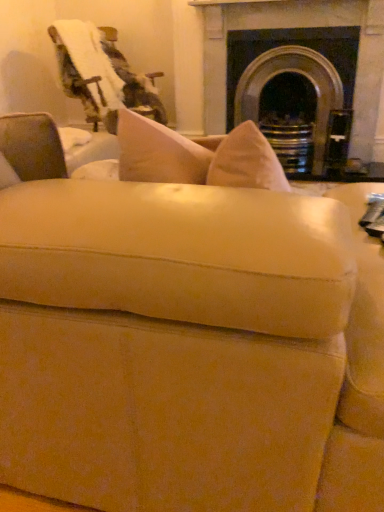
Question: Is dark gray stone fireplace at upper center taller or shorter than velvet-like swivel chair at upper left?

Choices:
 (A) short
 (B) tall

Answer: (B)

Question: Is dark gray stone fireplace at upper center wider or thinner than velvet-like swivel chair at upper left?

Choices:
 (A) thin
 (B) wide

Answer: (A)

Question: From the image's perspective, is dark gray stone fireplace at upper center positioned above or below velvet-like swivel chair at upper left?

Choices:
 (A) above
 (B) below

Answer: (A)

Question: Is velvet-like swivel chair at upper left inside the boundaries of dark gray stone fireplace at upper center, or outside?

Choices:
 (A) outside
 (B) inside

Answer: (A)

Question: Relative to dark gray stone fireplace at upper center, is velvet-like swivel chair at upper left in front or behind?

Choices:
 (A) behind
 (B) front

Answer: (B)

Question: From the image's perspective, is velvet-like swivel chair at upper left above or below dark gray stone fireplace at upper center?

Choices:
 (A) below
 (B) above

Answer: (A)

Question: Based on their sizes in the image, would you say velvet-like swivel chair at upper left is bigger or smaller than dark gray stone fireplace at upper center?

Choices:
 (A) big
 (B) small

Answer: (B)